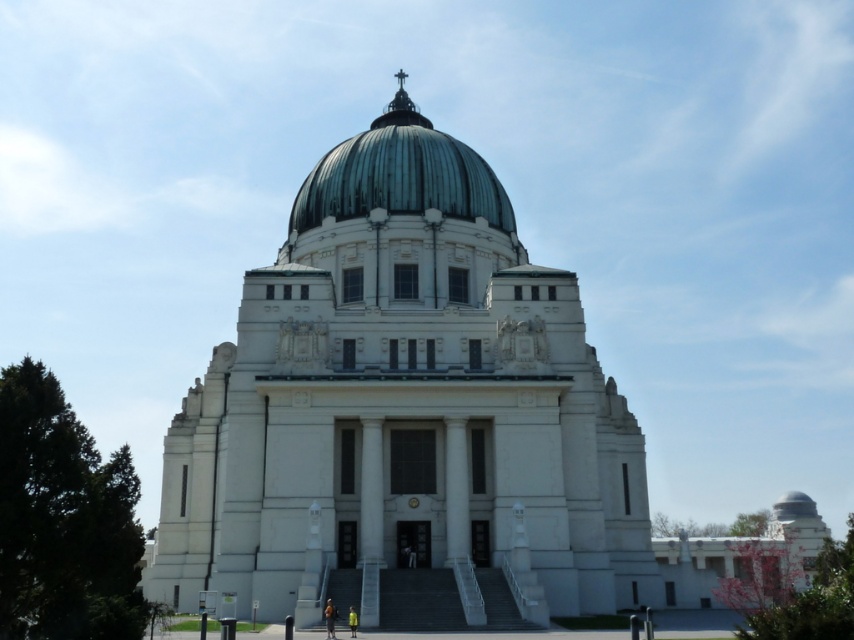
Question: Among these points, which one is nearest to the camera?

Choices:
 (A) (342, 166)
 (B) (224, 378)

Answer: (B)

Question: Can you confirm if white stone church at center is wider than green copper dome at center?

Choices:
 (A) no
 (B) yes

Answer: (B)

Question: Which of the following is the farthest from the observer?

Choices:
 (A) (320, 193)
 (B) (196, 547)

Answer: (A)

Question: Can you confirm if white stone church at center is positioned to the left of green copper dome at center?

Choices:
 (A) no
 (B) yes

Answer: (A)

Question: Where is white stone church at center located in relation to green copper dome at center in the image?

Choices:
 (A) below
 (B) above

Answer: (A)

Question: Which point is farther to the camera?

Choices:
 (A) (466, 173)
 (B) (215, 468)

Answer: (A)